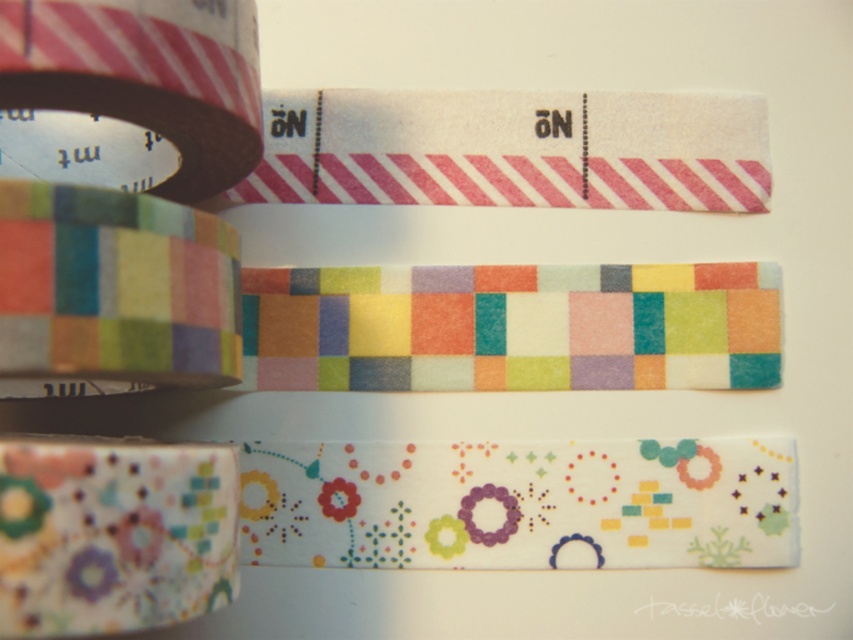
You need to choose a tape that can cover a large poster without tearing easily. Which one between the multicolored fabric measuring tape at upper left and the matte black tape at left would be more suitable?

The matte black tape at left is larger in size compared to the multicolored fabric measuring tape at upper left, so it would be more suitable for covering a large poster without tearing easily.